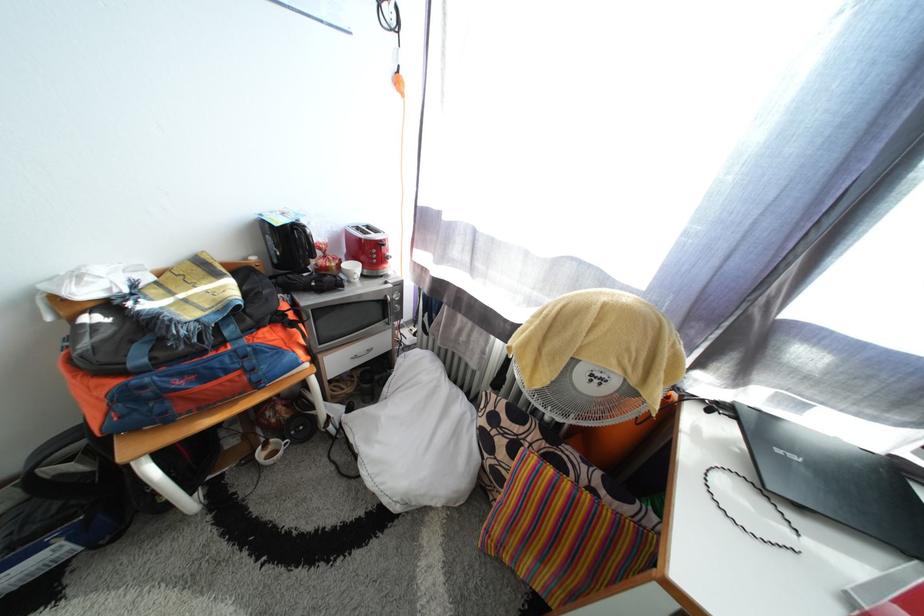
Describe the element at coordinates (362, 355) in the screenshot. I see `a drawer handle` at that location.